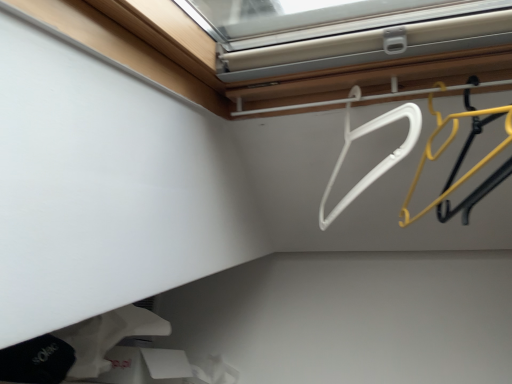
Question: Is white matte socks at lower left surrounded by yellow plastic hanger at upper right, which is the 1th hanger in right-to-left order?

Choices:
 (A) no
 (B) yes

Answer: (A)

Question: From the image's perspective, would you say yellow plastic hanger at upper right, the second hanger from the left, is positioned over white matte socks at lower left?

Choices:
 (A) yes
 (B) no

Answer: (A)

Question: Does yellow plastic hanger at upper right, the second hanger from the left, appear on the right side of white matte socks at lower left?

Choices:
 (A) yes
 (B) no

Answer: (A)

Question: Does yellow plastic hanger at upper right, the second hanger from the left, have a larger size compared to white matte socks at lower left?

Choices:
 (A) no
 (B) yes

Answer: (A)

Question: Is white matte socks at lower left at the back of yellow plastic hanger at upper right, which is the 1th hanger in right-to-left order?

Choices:
 (A) no
 (B) yes

Answer: (A)

Question: Is yellow plastic hanger at upper right, the second hanger from the left, further to the viewer compared to white matte socks at lower left?

Choices:
 (A) yes
 (B) no

Answer: (B)

Question: Considering the relative positions of white matte socks at lower left and yellow plastic hanger at upper right, which is the 1th hanger in right-to-left order, in the image provided, is white matte socks at lower left to the right of yellow plastic hanger at upper right, which is the 1th hanger in right-to-left order, from the viewer's perspective?

Choices:
 (A) yes
 (B) no

Answer: (B)

Question: Can you confirm if white matte socks at lower left is smaller than yellow plastic hanger at upper right, the second hanger from the left?

Choices:
 (A) no
 (B) yes

Answer: (A)

Question: From the image's perspective, is white matte socks at lower left under yellow plastic hanger at upper right, which is the 1th hanger in right-to-left order?

Choices:
 (A) yes
 (B) no

Answer: (A)

Question: Considering the relative sizes of white matte socks at lower left and yellow plastic hanger at upper right, the second hanger from the left, in the image provided, is white matte socks at lower left taller than yellow plastic hanger at upper right, the second hanger from the left,?

Choices:
 (A) no
 (B) yes

Answer: (B)

Question: From a real-world perspective, is white matte socks at lower left positioned under yellow plastic hanger at upper right, the second hanger from the left, based on gravity?

Choices:
 (A) yes
 (B) no

Answer: (A)

Question: Is white matte socks at lower left facing away from yellow plastic hanger at upper right, the second hanger from the left?

Choices:
 (A) yes
 (B) no

Answer: (B)

Question: Would you consider white plastic hanger at upper center, the second hanger when ordered from right to left, to be distant from yellow plastic hanger at upper right, the second hanger from the left?

Choices:
 (A) no
 (B) yes

Answer: (A)